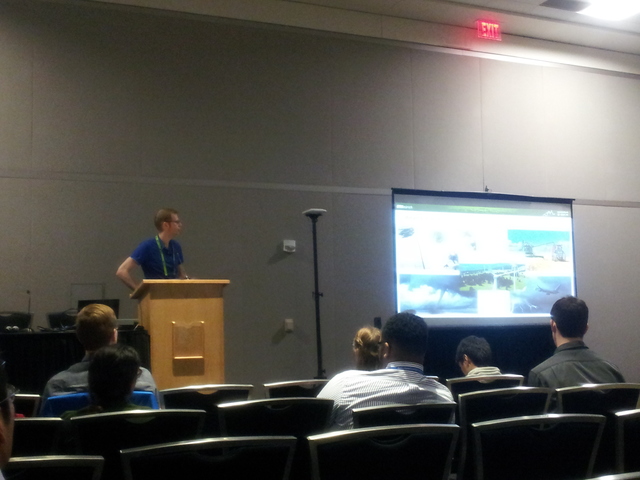
Find the location of a particular element. The height and width of the screenshot is (480, 640). ceiling is located at coordinates (536, 23).